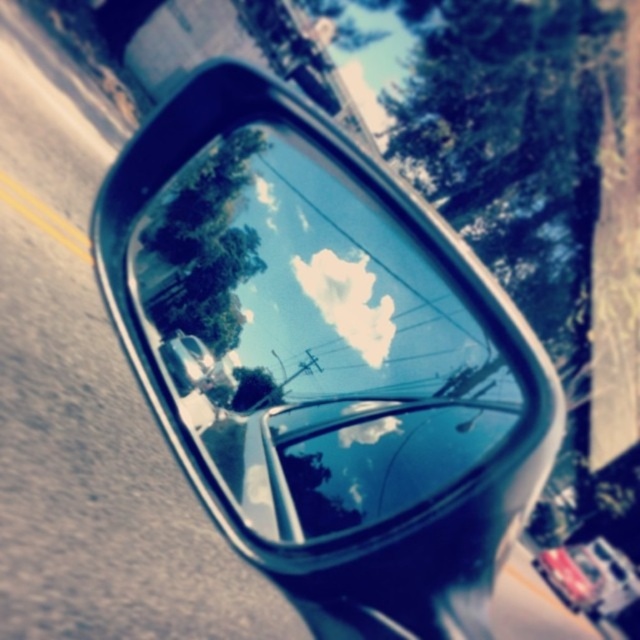
You are a driver checking your mirrors before changing lanes. You notice the glossy metallic side mirror at upper center and the metallic red car at lower right in your peripheral vision. Which object is positioned closer to the left side of your view?

The glossy metallic side mirror at upper center is positioned to the left of the metallic red car at lower right, so it is closer to the left side of your view.

You are driving a car and notice the glossy metallic side mirror at upper center. Based on its position, can you determine if it is the driver side or passenger side mirror?

The glossy metallic side mirror at upper center is located at point (310, 339), which places it on the driver side of the car.